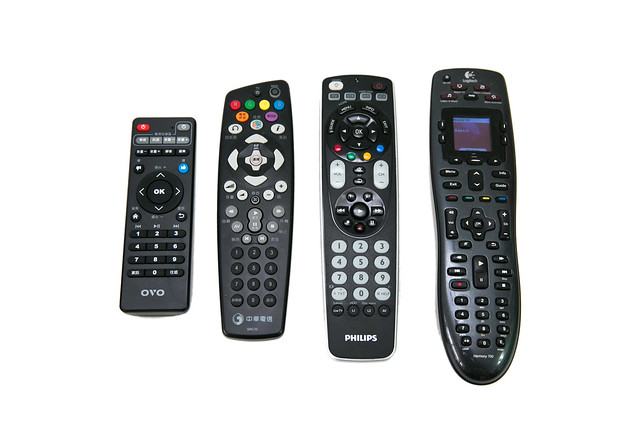
Locate an element on the screen. The image size is (640, 427). remote control is located at coordinates (168, 234), (237, 222), (344, 221), (490, 254).